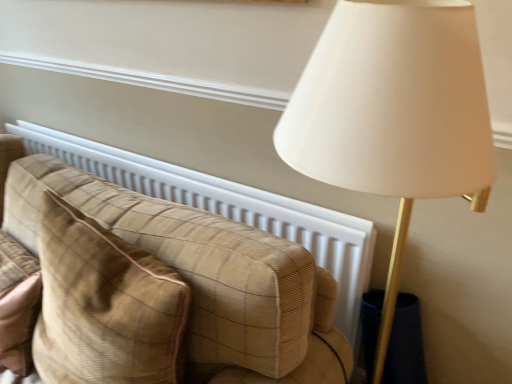
Question: Considering the positions of plaid fabric pillow at left and plaid fabric couch at center in the image, is plaid fabric pillow at left bigger or smaller than plaid fabric couch at center?

Choices:
 (A) small
 (B) big

Answer: (A)

Question: From a real-world perspective, is plaid fabric pillow at left physically located above or below plaid fabric couch at center?

Choices:
 (A) above
 (B) below

Answer: (A)

Question: Is plaid fabric pillow at left spatially inside plaid fabric couch at center, or outside of it?

Choices:
 (A) inside
 (B) outside

Answer: (B)

Question: Looking at the image, does plaid fabric couch at center seem bigger or smaller compared to plaid fabric pillow at left?

Choices:
 (A) small
 (B) big

Answer: (B)

Question: From a real-world perspective, is plaid fabric couch at center positioned above or below plaid fabric pillow at left?

Choices:
 (A) below
 (B) above

Answer: (A)

Question: Do you think plaid fabric couch at center is within plaid fabric pillow at left, or outside of it?

Choices:
 (A) inside
 (B) outside

Answer: (B)

Question: Looking at their shapes, would you say plaid fabric couch at center is wider or thinner than plaid fabric pillow at left?

Choices:
 (A) thin
 (B) wide

Answer: (A)